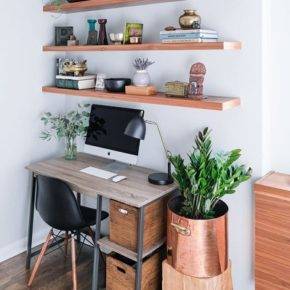
Image resolution: width=290 pixels, height=290 pixels. In order to click on shelves in this screenshot , I will do `click(104, 3)`, `click(123, 47)`, `click(117, 94)`.